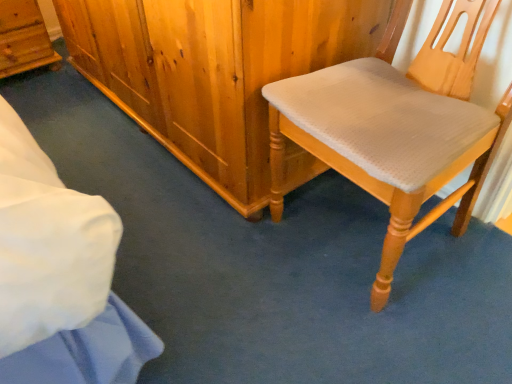
Measure the distance between point (421, 97) and camera.

The distance of point (421, 97) from camera is 1.01 meters.

This screenshot has height=384, width=512. Find the location of `light wood/texture chair at right`. light wood/texture chair at right is located at coordinates pos(395,127).

The height and width of the screenshot is (384, 512). What do you see at coordinates (395, 127) in the screenshot? I see `light wood/texture chair at right` at bounding box center [395, 127].

What do you see at coordinates (23, 38) in the screenshot? I see `wooden cabinet at upper left` at bounding box center [23, 38].

Measure the distance between point (13, 69) and camera.

They are 6.62 feet apart.

Image resolution: width=512 pixels, height=384 pixels. Find the location of `wooden cabinet at upper left`. wooden cabinet at upper left is located at coordinates (23, 38).

The height and width of the screenshot is (384, 512). In order to click on light wood/texture chair at right in this screenshot , I will do `click(395, 127)`.

Between light wood/texture chair at right and wooden cabinet at upper left, which one appears on the right side from the viewer's perspective?

Positioned to the right is light wood/texture chair at right.

Looking at this image, which object is closer to the camera, light wood/texture chair at right or wooden cabinet at upper left?

light wood/texture chair at right is in front.

Considering the positions of point (492, 132) and point (29, 24), is point (492, 132) closer or farther from the camera than point (29, 24)?

Point (492, 132).

From the image's perspective, would you say light wood/texture chair at right is shown under wooden cabinet at upper left?

Yes, from the image's perspective, light wood/texture chair at right is below wooden cabinet at upper left.

Based on the photo, from a real-world perspective, which is physically above, light wood/texture chair at right or wooden cabinet at upper left?

light wood/texture chair at right is physically above.

Between light wood/texture chair at right and wooden cabinet at upper left, which one has larger width?

Wider between the two is light wood/texture chair at right.

Is light wood/texture chair at right shorter than wooden cabinet at upper left?

Incorrect, the height of light wood/texture chair at right does not fall short of that of wooden cabinet at upper left.

Who is smaller, light wood/texture chair at right or wooden cabinet at upper left?

With smaller size is wooden cabinet at upper left.

Is light wood/texture chair at right spatially inside wooden cabinet at upper left, or outside of it?

light wood/texture chair at right cannot be found inside wooden cabinet at upper left.

Does light wood/texture chair at right touch wooden cabinet at upper left?

They are not placed beside each other.

Is light wood/texture chair at right oriented towards wooden cabinet at upper left?

No, light wood/texture chair at right is not facing towards wooden cabinet at upper left.

What are the coordinates of `chair located below the wooden cabinet at upper left (from the image's perspective)` in the screenshot? It's located at (395, 127).

Visually, is wooden cabinet at upper left positioned to the left or to the right of light wood/texture chair at right?

In the image, wooden cabinet at upper left appears on the left side of light wood/texture chair at right.

In the image, is wooden cabinet at upper left positioned in front of or behind light wood/texture chair at right?

wooden cabinet at upper left is positioned farther from the viewer than light wood/texture chair at right.

Is point (8, 52) farther from viewer compared to point (418, 137)?

Yes.

From the image's perspective, does wooden cabinet at upper left appear lower than light wood/texture chair at right?

No, from the image's perspective, wooden cabinet at upper left is not below light wood/texture chair at right.

From a real-world perspective, is wooden cabinet at upper left physically above light wood/texture chair at right?

No, from a real-world perspective, wooden cabinet at upper left is not on top of light wood/texture chair at right.

Is wooden cabinet at upper left thinner than light wood/texture chair at right?

Yes, wooden cabinet at upper left is thinner than light wood/texture chair at right.

Can you confirm if wooden cabinet at upper left is taller than light wood/texture chair at right?

In fact, wooden cabinet at upper left may be shorter than light wood/texture chair at right.

Between wooden cabinet at upper left and light wood/texture chair at right, which one has smaller size?

With smaller size is wooden cabinet at upper left.

Is wooden cabinet at upper left positioned beyond the bounds of light wood/texture chair at right?

That's correct, wooden cabinet at upper left is outside of light wood/texture chair at right.

Can you see wooden cabinet at upper left touching light wood/texture chair at right?

No, wooden cabinet at upper left is not making contact with light wood/texture chair at right.

Is wooden cabinet at upper left facing towards light wood/texture chair at right?

Yes, wooden cabinet at upper left faces towards light wood/texture chair at right.

The image size is (512, 384). What are the coordinates of `cabinetry that appears above the light wood/texture chair at right (from the image's perspective)` in the screenshot? It's located at click(23, 38).

The width and height of the screenshot is (512, 384). I want to click on cabinetry on the left of the light wood/texture chair at right, so click(23, 38).

At what (x,y) coordinates should I click in order to perform the action: click on chair below the wooden cabinet at upper left (from the image's perspective). Please return your answer as a coordinate pair (x, y). This screenshot has height=384, width=512. Looking at the image, I should click on (395, 127).